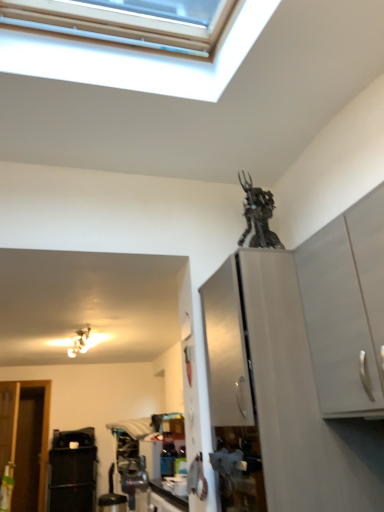
Question: Is white matte cabinet at upper right, which is the 2th cabinetry in back-to-front order, inside metallic silver light fixture at upper left?

Choices:
 (A) no
 (B) yes

Answer: (A)

Question: Is metallic silver light fixture at upper left directly adjacent to white matte cabinet at upper right, which is the 2th cabinetry in back-to-front order?

Choices:
 (A) yes
 (B) no

Answer: (B)

Question: Is metallic silver light fixture at upper left to the right of white matte cabinet at upper right, arranged as the 1th cabinetry when viewed from the front, from the viewer's perspective?

Choices:
 (A) no
 (B) yes

Answer: (A)

Question: From the image's perspective, is metallic silver light fixture at upper left under white matte cabinet at upper right, arranged as the 1th cabinetry when viewed from the front?

Choices:
 (A) yes
 (B) no

Answer: (A)

Question: Can you confirm if metallic silver light fixture at upper left is shorter than white matte cabinet at upper right, which is the 2th cabinetry in back-to-front order?

Choices:
 (A) yes
 (B) no

Answer: (A)

Question: Considering the relative sizes of metallic silver light fixture at upper left and white matte cabinet at upper right, which is the 2th cabinetry in back-to-front order, in the image provided, is metallic silver light fixture at upper left thinner than white matte cabinet at upper right, which is the 2th cabinetry in back-to-front order,?

Choices:
 (A) yes
 (B) no

Answer: (B)

Question: Can you confirm if metallic statue at upper center is shorter than satin white cabinet at upper right, the second cabinetry positioned from the front?

Choices:
 (A) yes
 (B) no

Answer: (A)

Question: Can you confirm if metallic statue at upper center is smaller than satin white cabinet at upper right, marked as the first cabinetry in a back-to-front arrangement?

Choices:
 (A) no
 (B) yes

Answer: (B)

Question: Can you confirm if metallic statue at upper center is wider than satin white cabinet at upper right, marked as the first cabinetry in a back-to-front arrangement?

Choices:
 (A) no
 (B) yes

Answer: (A)

Question: Considering the relative sizes of metallic statue at upper center and satin white cabinet at upper right, marked as the first cabinetry in a back-to-front arrangement, in the image provided, is metallic statue at upper center bigger than satin white cabinet at upper right, marked as the first cabinetry in a back-to-front arrangement,?

Choices:
 (A) yes
 (B) no

Answer: (B)

Question: Is metallic statue at upper center thinner than satin white cabinet at upper right, marked as the first cabinetry in a back-to-front arrangement?

Choices:
 (A) no
 (B) yes

Answer: (B)

Question: Is metallic statue at upper center far away from satin white cabinet at upper right, the second cabinetry positioned from the front?

Choices:
 (A) no
 (B) yes

Answer: (A)

Question: Is white matte cabinet at upper right, arranged as the 1th cabinetry when viewed from the front, to the left of black plastic trash can at lower left from the viewer's perspective?

Choices:
 (A) no
 (B) yes

Answer: (A)